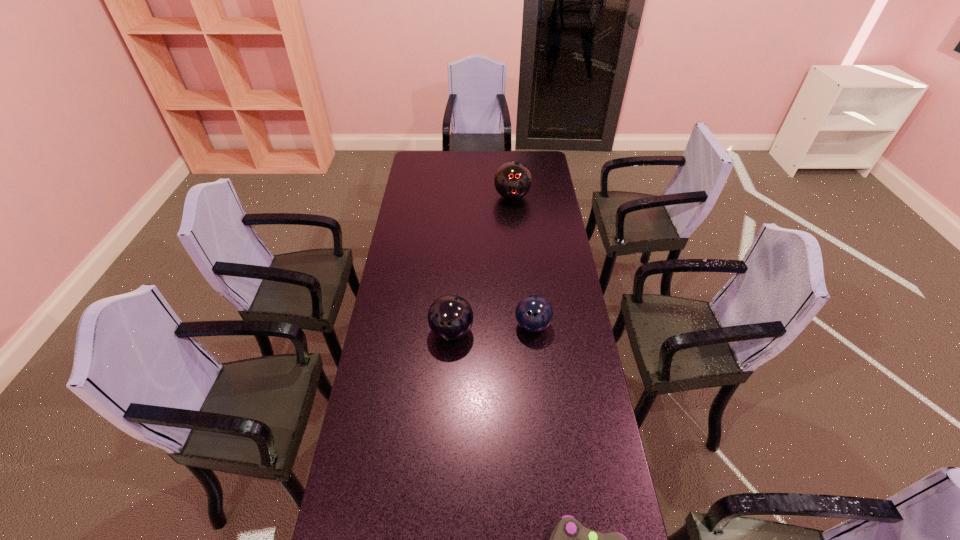
This screenshot has width=960, height=540. I want to click on free space between the second shortest object and the farthest bowling ball, so click(x=522, y=261).

The height and width of the screenshot is (540, 960). What are the coordinates of `empty space between the farthest bowling ball and the leftmost bowling ball` in the screenshot? It's located at (482, 264).

Identify the location of vacant area between the shortest bowling ball and the farthest bowling ball. This screenshot has width=960, height=540. (522, 261).

Locate an element on the screen. vacant area that lies between the shortest bowling ball and the leftmost object is located at coordinates (492, 328).

Identify which object is located as the nearest to the leftmost bowling ball. Please provide its 2D coordinates. Your answer should be formatted as a tuple, i.e. [(x, y)], where the tuple contains the x and y coordinates of a point satisfying the conditions above.

[(533, 313)]

Point out which object is positioned as the second nearest to the farthest object. Please provide its 2D coordinates. Your answer should be formatted as a tuple, i.e. [(x, y)], where the tuple contains the x and y coordinates of a point satisfying the conditions above.

[(450, 317)]

The width and height of the screenshot is (960, 540). In order to click on bowling ball that stands as the third closest to the control in this screenshot , I will do `click(513, 180)`.

Locate an element on the screen. The width and height of the screenshot is (960, 540). the closest bowling ball to the leftmost object is located at coordinates (533, 313).